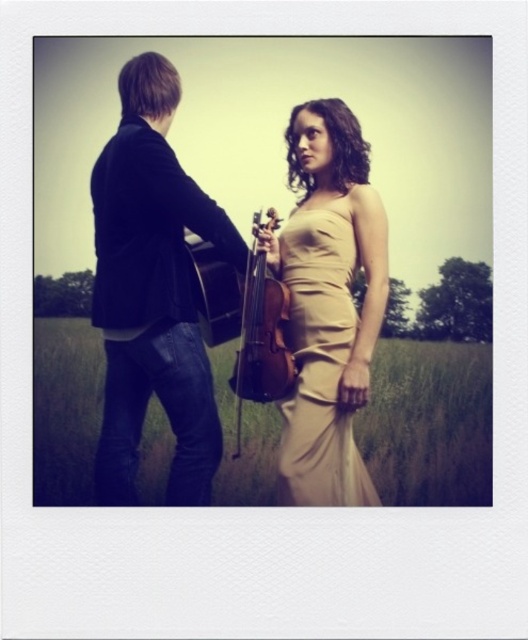
You are a photographer positioned at the camera. You need to capture a closeup shot of the dark blue denim jeans at left without moving the subject. Can you do it with a standard lens that has a maximum focal length of 50mm? Explain your reasoning.

The dark blue denim jeans at left is 2.63 meters from camera. A standard lens with a 50mm focal length is suitable for capturing closeup shots from this distance without requiring the photographer to move closer. Therefore, the photographer can achieve the desired closeup using the standard lens.

You are standing in the field and want to walk from point A to point B. Point A is at coordinates point [71,436] and point B is at coordinates point [286,316]. Which direction should you face to walk towards point B from point A?

To walk from point A to point B, you should face towards the upper left direction since point B is located at upper left relative to point A.

You are a photographer who needs to capture a closeup shot of the dark blue denim jeans at left and the satin beige dress at center. Your camera can only focus on objects within a 60 cm range. Can you take a photo that includes both subjects without moving the camera?

The dark blue denim jeans at left and satin beige dress at center are 62.92 centimeters apart, which exceeds the camera focus range of 60 cm. Therefore, you cannot capture both subjects in focus without moving the camera.